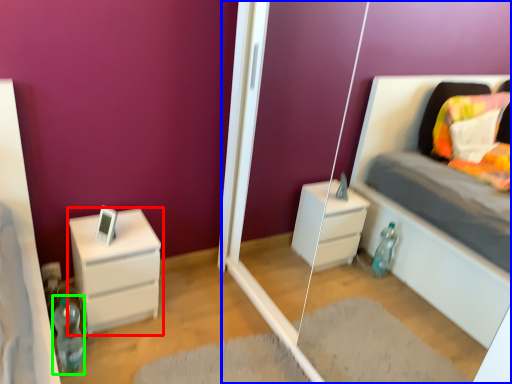
Question: Which object is the farthest from chest of drawers (highlighted by a red box)? Choose among these: glass door (highlighted by a blue box) or bottle (highlighted by a green box).

Choices:
 (A) glass door
 (B) bottle

Answer: (A)